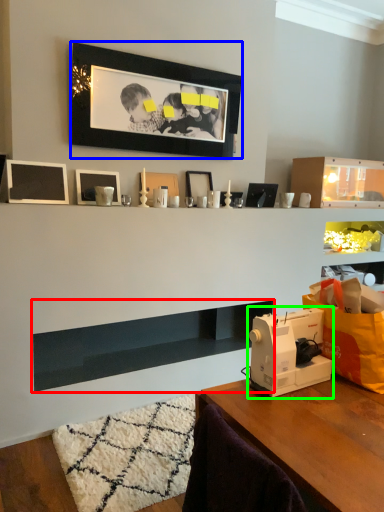
Question: Estimate the real-world distances between objects in this image. Which object is closer to shelf (highlighted by a red box), picture frame (highlighted by a blue box) or sewing machine (highlighted by a green box)?

Choices:
 (A) picture frame
 (B) sewing machine

Answer: (B)